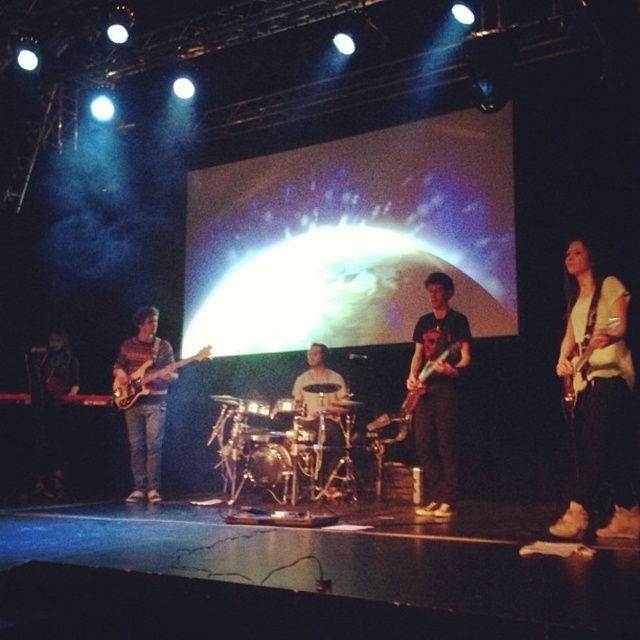
Question: Which point is closer to the camera?

Choices:
 (A) [x=35, y=408]
 (B) [x=304, y=392]

Answer: (B)

Question: Considering the relative positions of knit sweater at left and matte black electric guitar at left in the image provided, where is knit sweater at left located with respect to matte black electric guitar at left?

Choices:
 (A) below
 (B) above

Answer: (A)

Question: Does knit sweater at left have a greater width compared to matte black electric guitar at left?

Choices:
 (A) no
 (B) yes

Answer: (A)

Question: Which of the following is the farthest from the observer?

Choices:
 (A) knit sweater at left
 (B) matte black electric guitar at left
 (C) matte black electric guitar at center
 (D) matte black guitar at center

Answer: (A)

Question: Is the position of light yellow shirt at right less distant than that of metallic drum set at center?

Choices:
 (A) yes
 (B) no

Answer: (A)

Question: Among these objects, which one is nearest to the camera?

Choices:
 (A) metallic drum set at center
 (B) glossy wood guitar at center
 (C) knit sweater at left
 (D) matte black guitar at left

Answer: (B)